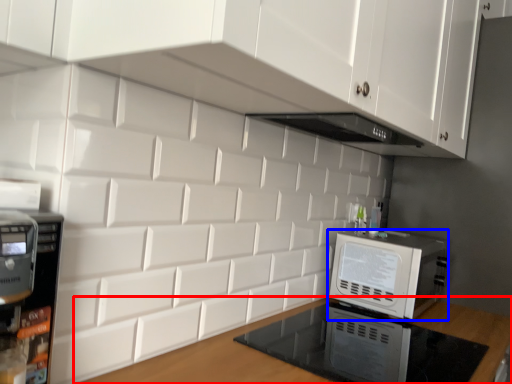
Question: Which of the following is the closest to the observer, countertop (highlighted by a red box) or home appliance (highlighted by a blue box)?

Choices:
 (A) countertop
 (B) home appliance

Answer: (A)